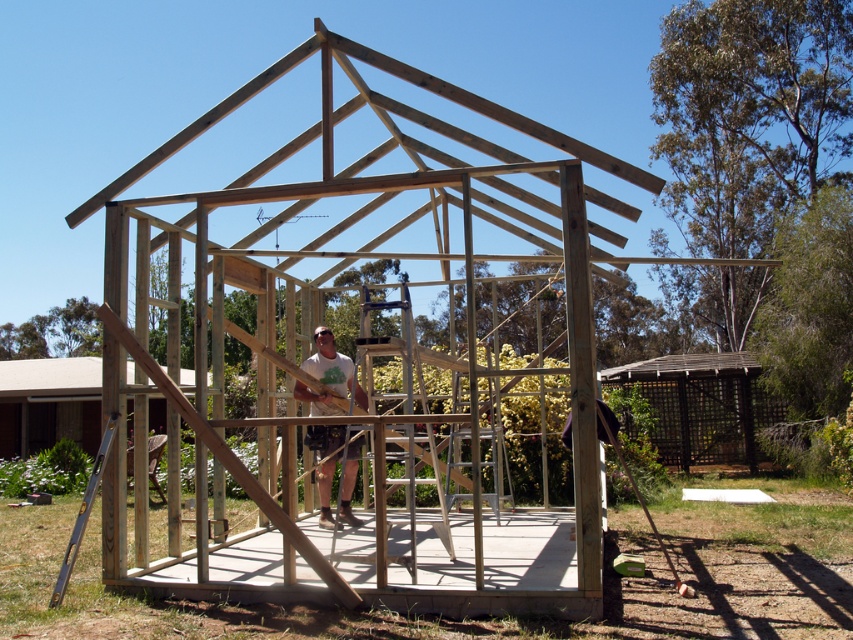
Does natural wood frame at center lie in front of natural wood hut at center?

Yes, it is.

Locate an element on the screen. This screenshot has height=640, width=853. natural wood frame at center is located at coordinates (415, 276).

Can you confirm if brown woven hut at lower right is thinner than wooden planks at center?

No, brown woven hut at lower right is not thinner than wooden planks at center.

Does brown woven hut at lower right appear on the left side of wooden planks at center?

Incorrect, brown woven hut at lower right is not on the left side of wooden planks at center.

Which is behind, point (763, 404) or point (341, 365)?

Positioned behind is point (763, 404).

This screenshot has height=640, width=853. I want to click on brown woven hut at lower right, so click(x=701, y=404).

Is natural wood frame at center in front of brown woven hut at lower right?

Yes, natural wood frame at center is in front of brown woven hut at lower right.

Between natural wood frame at center and brown woven hut at lower right, which one has less height?

brown woven hut at lower right is shorter.

Is point (468, 164) farther from camera compared to point (704, 451)?

That is False.

You are a GUI agent. You are given a task and a screenshot of the screen. Output one action in this format:
    pyautogui.click(x=<x>, y=<y>)
    Task: Click on the natural wood frame at center
    
    Given the screenshot: What is the action you would take?
    pyautogui.click(x=415, y=276)